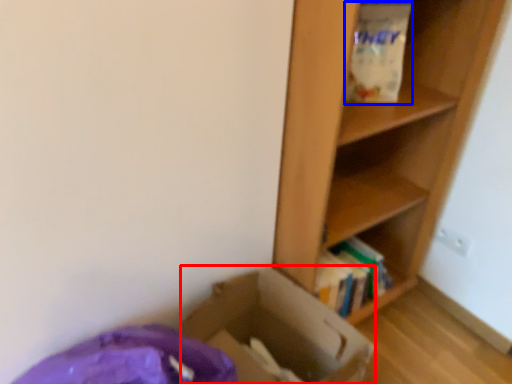
Question: Which of the following is the farthest to the observer, cardboard box (highlighted by a red box) or paper bag (highlighted by a blue box)?

Choices:
 (A) cardboard box
 (B) paper bag

Answer: (B)